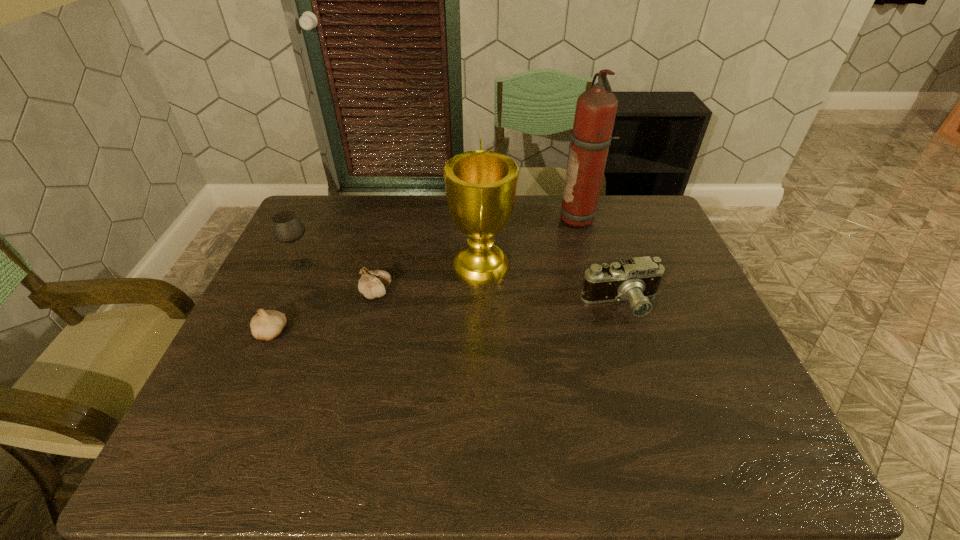
This screenshot has height=540, width=960. Find the location of `vacant area situated on the side of the tallest object with the label and nozzle`. vacant area situated on the side of the tallest object with the label and nozzle is located at coordinates (495, 219).

Locate an element on the screen. This screenshot has width=960, height=540. vacant position located on the side of the tallest object with the label and nozzle is located at coordinates (540, 219).

Identify the location of free space located on the shiny surface of the fifth shortest object. The width and height of the screenshot is (960, 540). (422, 266).

The height and width of the screenshot is (540, 960). I want to click on vacant region located 0.090m on the shiny surface of the fifth shortest object, so click(419, 266).

Locate an element on the screen. The width and height of the screenshot is (960, 540). vacant space located 0.050m on the shiny surface of the fifth shortest object is located at coordinates (432, 266).

Identify the location of blank space located on the right of the wineglass. This screenshot has width=960, height=540. [x=442, y=265].

In order to click on free spot located 0.290m at the lens of the camera in this screenshot , I will do `click(660, 426)`.

Identify the location of free space located 0.320m on the front of the third object from left to right. (348, 409).

You are a GUI agent. You are given a task and a screenshot of the screen. Output one action in this format:
    pyautogui.click(x=<x>, y=<y>)
    Task: Click on the free spot located 0.340m on the back of the shortest object
    This screenshot has width=960, height=540.
    Given the screenshot: What is the action you would take?
    pyautogui.click(x=312, y=240)

Where is `fire extinguisher that is at the far edge`? fire extinguisher that is at the far edge is located at coordinates (596, 108).